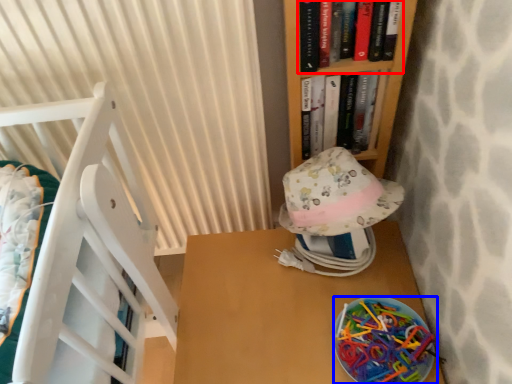
Question: Among these objects, which one is farthest to the camera, book (highlighted by a red box) or stuff (highlighted by a blue box)?

Choices:
 (A) book
 (B) stuff

Answer: (B)